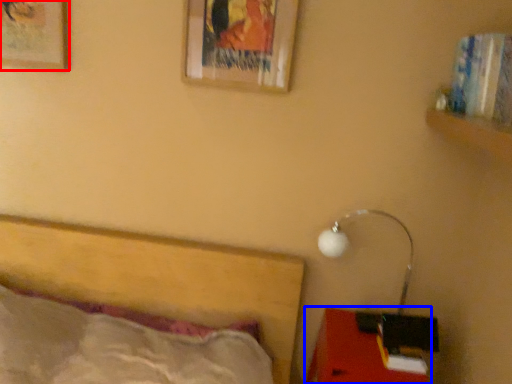
Question: Which object is further to the camera taking this photo, picture frame (highlighted by a red box) or furniture (highlighted by a blue box)?

Choices:
 (A) picture frame
 (B) furniture

Answer: (A)